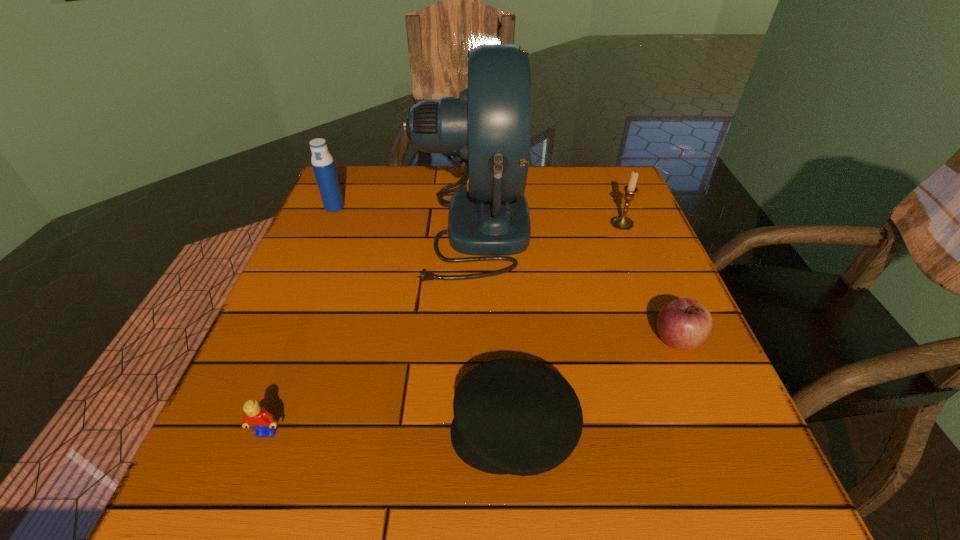
This screenshot has height=540, width=960. Identify the location of the tallest object. (488, 127).

Where is `water bottle`? This screenshot has height=540, width=960. water bottle is located at coordinates (322, 161).

In order to click on the third tallest object in this screenshot , I will do `click(621, 222)`.

Image resolution: width=960 pixels, height=540 pixels. Find the location of `apple`. apple is located at coordinates (684, 324).

Find the location of `the third nearest object`. the third nearest object is located at coordinates (684, 324).

Locate an element on the screen. This screenshot has width=960, height=540. beret is located at coordinates (512, 416).

Identify the location of Lego. The image size is (960, 540). (258, 418).

You are a GUI agent. You are given a task and a screenshot of the screen. Output one action in this format:
    pyautogui.click(x=<x>, y=<y>)
    Task: Click on the vacant area located in front of the tallest object to blow air
    This screenshot has height=540, width=960.
    Given the screenshot: What is the action you would take?
    pyautogui.click(x=566, y=228)

Locate an element on the screen. Image resolution: width=960 pixels, height=540 pixels. free spot located on the right of the water bottle is located at coordinates (372, 207).

Where is `vacant space situated 0.090m on the left of the candle holder`? The width and height of the screenshot is (960, 540). vacant space situated 0.090m on the left of the candle holder is located at coordinates (574, 224).